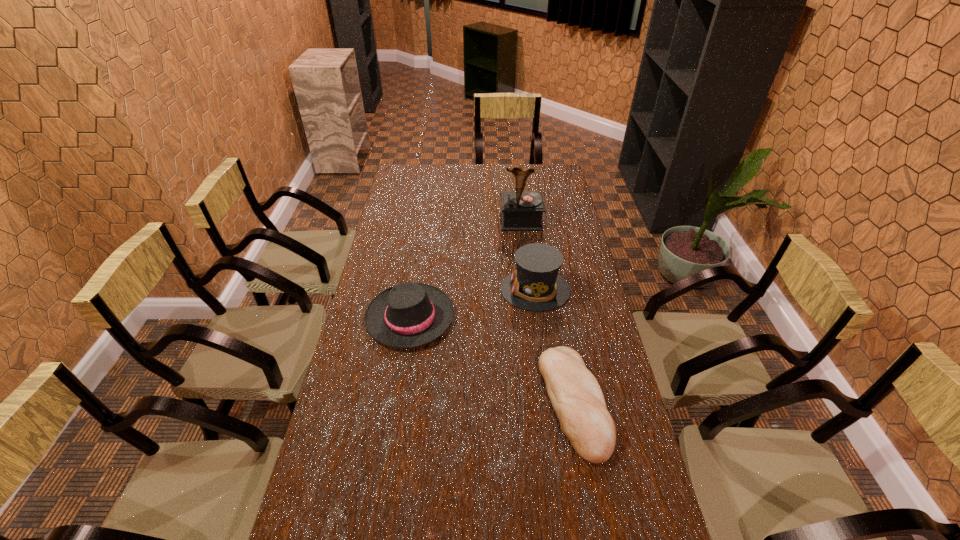
Identify the location of blank space located 0.130m with goggles on the front of the third shortest object. The height and width of the screenshot is (540, 960). (464, 290).

You are a GUI agent. You are given a task and a screenshot of the screen. Output one action in this format:
    pyautogui.click(x=<x>, y=<y>)
    Task: Click on the free region located 0.210m on the front of the shorter dress hat
    Image resolution: width=960 pixels, height=540 pixels.
    Given the screenshot: What is the action you would take?
    pyautogui.click(x=396, y=412)

Where is `vacant space located 0.100m on the left of the bread`? The height and width of the screenshot is (540, 960). vacant space located 0.100m on the left of the bread is located at coordinates (507, 402).

The width and height of the screenshot is (960, 540). In order to click on object situated at the left edge in this screenshot , I will do tap(408, 315).

Locate an element on the screen. This screenshot has width=960, height=540. phonograph_record that is at the right edge is located at coordinates (522, 210).

The height and width of the screenshot is (540, 960). Find the location of `dress hat that is at the right edge`. dress hat that is at the right edge is located at coordinates (536, 285).

Locate an element on the screen. The width and height of the screenshot is (960, 540). bread that is positioned at the right edge is located at coordinates (577, 399).

Where is `vacant space at the far edge of the desktop`? The height and width of the screenshot is (540, 960). vacant space at the far edge of the desktop is located at coordinates (518, 166).

Identify the location of free space at the left edge of the desktop. This screenshot has width=960, height=540. (366, 424).

In the image, there is a desktop. Identify the location of vacant space at the right edge. pos(559,272).